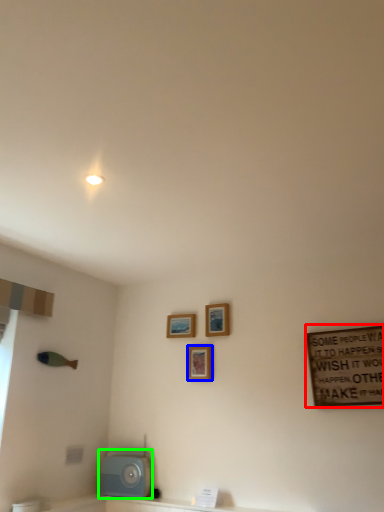
Question: Which object is the farthest from bulletin board (highlighted by a red box)? Choose among these: picture frame (highlighted by a blue box) or appliance (highlighted by a green box).

Choices:
 (A) picture frame
 (B) appliance

Answer: (B)